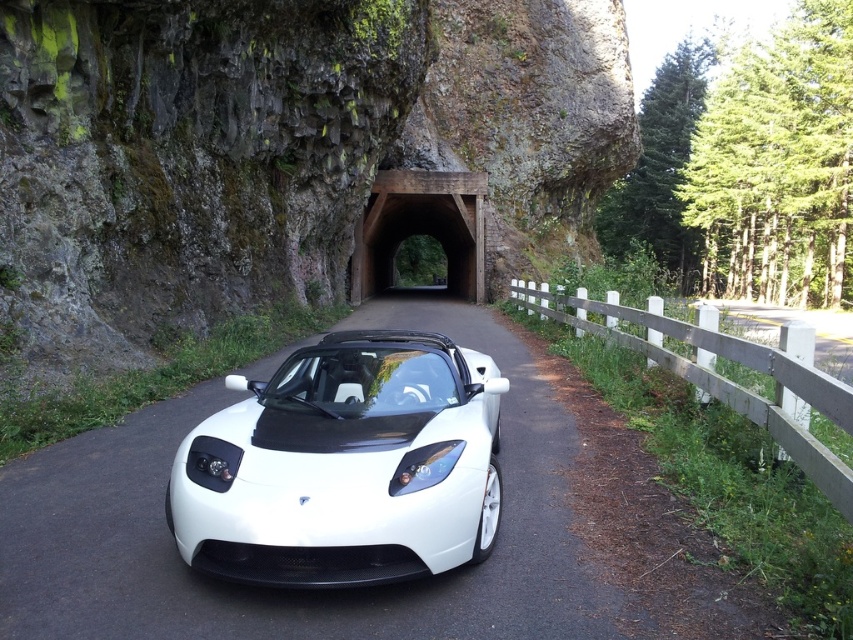
You are a delivery person trying to park your van behind the white matte car at center and the white matte sports car at center. Since your van is 6 meters long, can you fit it between them if there is a 7 meter gap available?

The white matte car at center is positioned under the white matte sports car at center, so there is no space between them. Therefore, the van cannot fit in the 7 meter gap between them.

You are standing at the point marked by the coordinates point (392, 584) in the image. Looking around, what object are you directly facing?

The point (392, 584) marks the white matte car at center, so you are directly facing the white matte car at center.

You are a delivery drone trying to land on the road near the white matte sports car at center. The landing coordinates are given as point (345, 465). Can you confirm if this point is on the road?

The white matte sports car at center is represented by point (345, 465), so the landing coordinates are directly at the car, meaning the drone cannot land there as it is occupied by the vehicle.